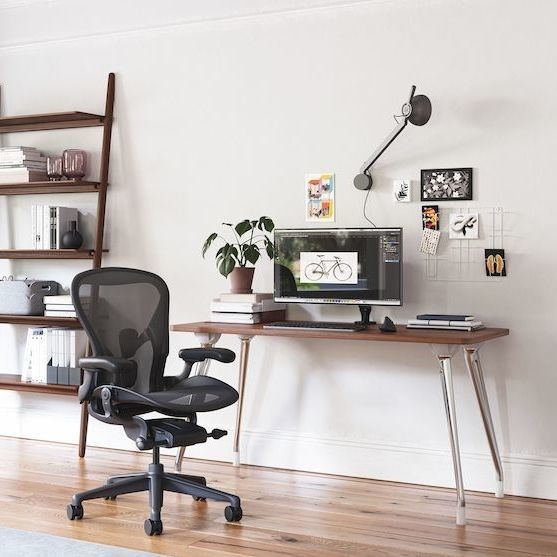
You are a GUI agent. You are given a task and a screenshot of the screen. Output one action in this format:
    pyautogui.click(x=<x>, y=<y>)
    Task: Click on the chair
    Image resolution: width=557 pixels, height=557 pixels.
    Given the screenshot: What is the action you would take?
    pyautogui.click(x=165, y=390)